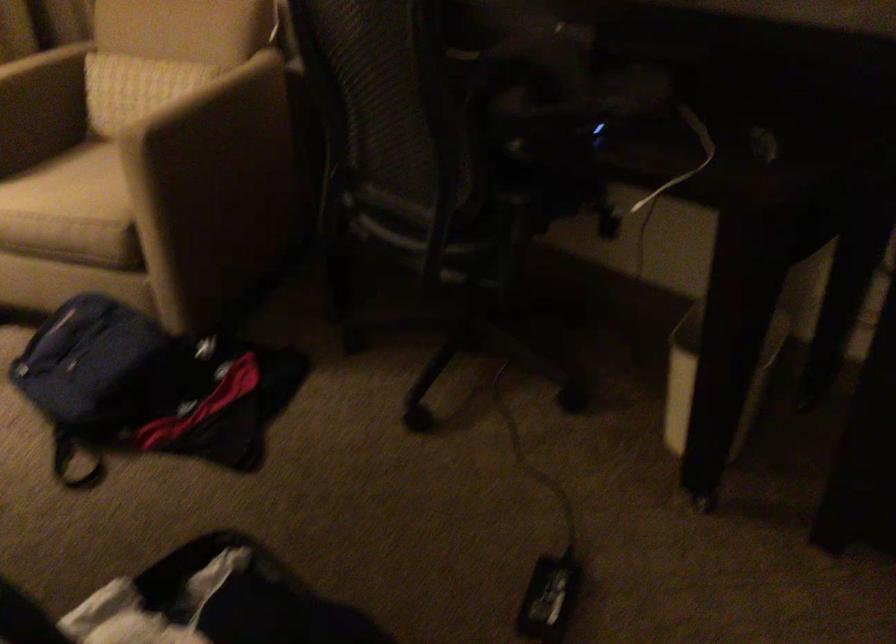
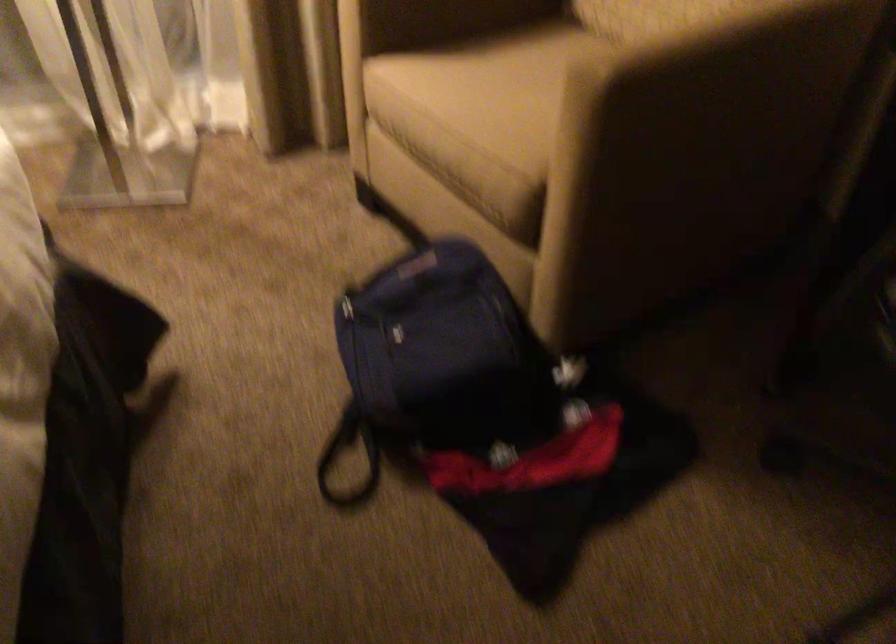
Question: I am providing you with two images of the same scene from different viewpoints. Which of the following objects are not visible in image2?

Choices:
 (A) black backpack strap
 (B) chair sitting surface
 (C) beige chair armrest
 (D) none of these

Answer: (D)